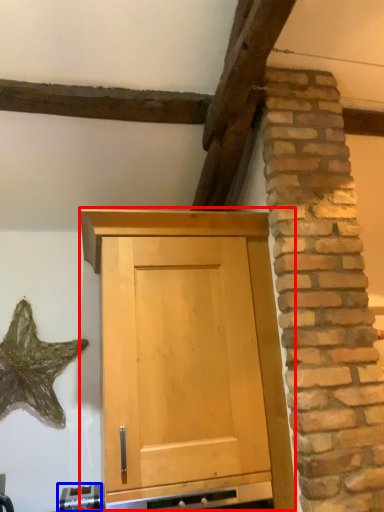
Question: Among these objects, which one is nearest to the camera, cupboard (highlighted by a red box) or appliance (highlighted by a blue box)?

Choices:
 (A) cupboard
 (B) appliance

Answer: (A)